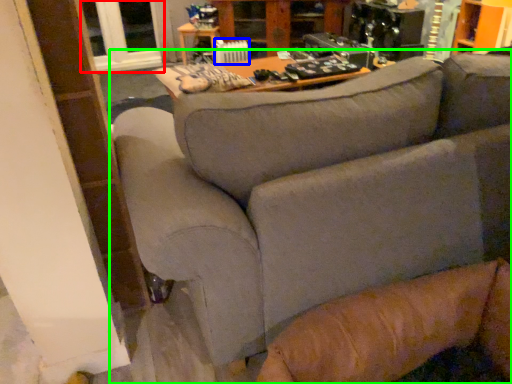
Question: Based on their relative distances, which object is nearer to window (highlighted by a red box)? Choose from radiator (highlighted by a blue box) and studio couch (highlighted by a green box).

Choices:
 (A) radiator
 (B) studio couch

Answer: (A)